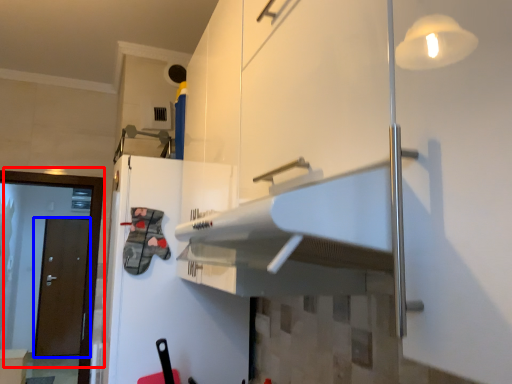
Question: Which object is further to the camera taking this photo, door (highlighted by a red box) or door (highlighted by a blue box)?

Choices:
 (A) door
 (B) door

Answer: (B)